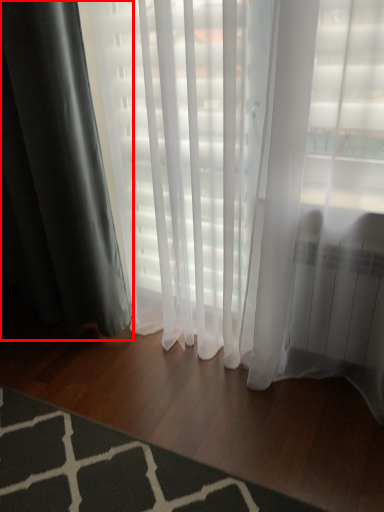
Question: Observing the image, what is the correct spatial positioning of curtain (annotated by the red box) in reference to mat?

Choices:
 (A) left
 (B) right

Answer: (A)